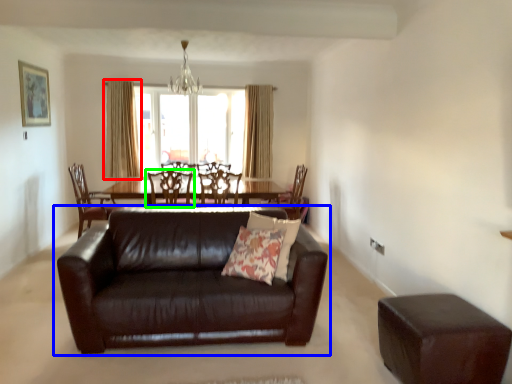
Question: Which object is the farthest from curtain (highlighted by a red box)? Choose among these: studio couch (highlighted by a blue box) or chair (highlighted by a green box).

Choices:
 (A) studio couch
 (B) chair

Answer: (A)